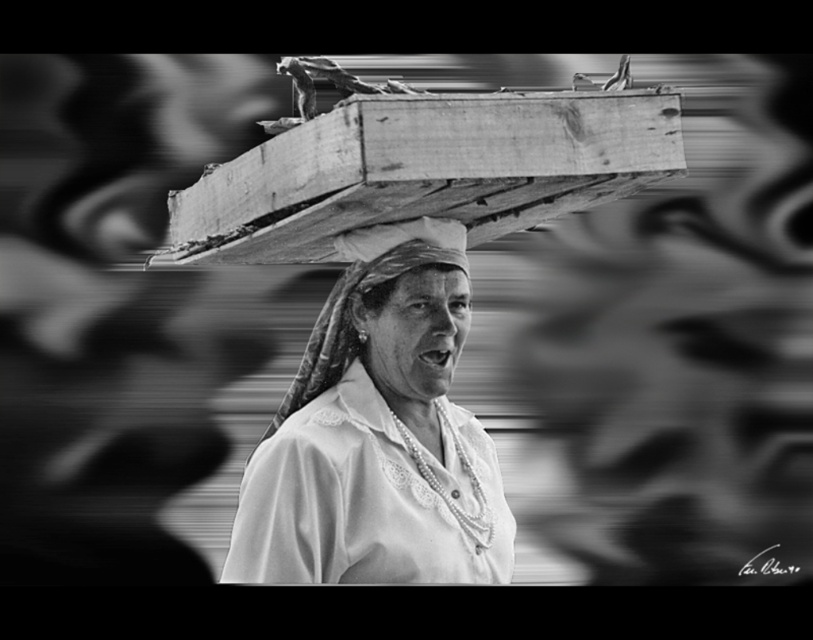
Does white lace shirt at center appear over smooth fabric headscarf at center?

No.

This screenshot has width=813, height=640. I want to click on white lace shirt at center, so click(x=377, y=433).